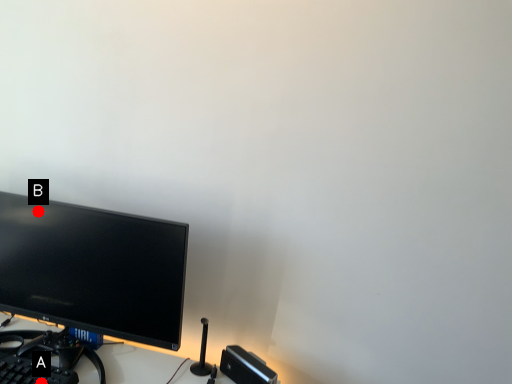
Question: Two points are circled on the image, labeled by A and B beside each circle. Which of the following is the farthest from the observer?

Choices:
 (A) A is further
 (B) B is further

Answer: (B)